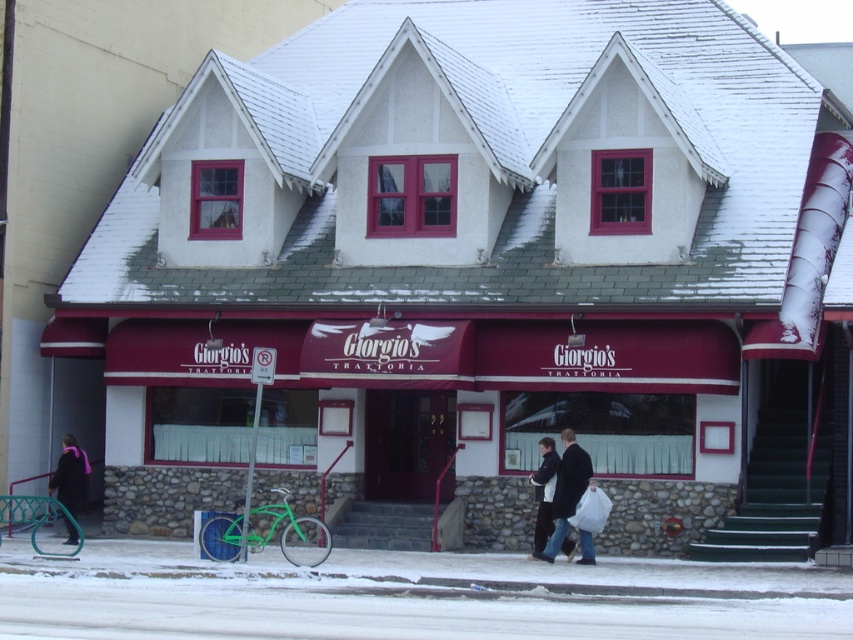
Who is lower down, white snow at lower center or velvet purple scarf at lower left?

Positioned lower is white snow at lower center.

Does point (389, 604) come in front of point (68, 532)?

Yes, it is in front of point (68, 532).

You are a GUI agent. You are given a task and a screenshot of the screen. Output one action in this format:
    pyautogui.click(x=<x>, y=<y>)
    Task: Click on the white snow at lower center
    Image resolution: width=853 pixels, height=640 pixels.
    Given the screenshot: What is the action you would take?
    pyautogui.click(x=409, y=595)

Find the location of a particular element. dark gray wool coat at center is located at coordinates (566, 492).

Which is behind, point (581, 461) or point (73, 541)?

Point (73, 541)

Is point (572, 467) positioned behind point (78, 454)?

No, (572, 467) is in front of (78, 454).

Identify the location of dark gray wool coat at center. (566, 492).

Does white snow at lower center lie behind dark gray wool coat at center?

No, it is not.

Is white snow at lower center thinner than dark gray wool coat at center?

No.

Identify the location of white snow at lower center. pos(409,595).